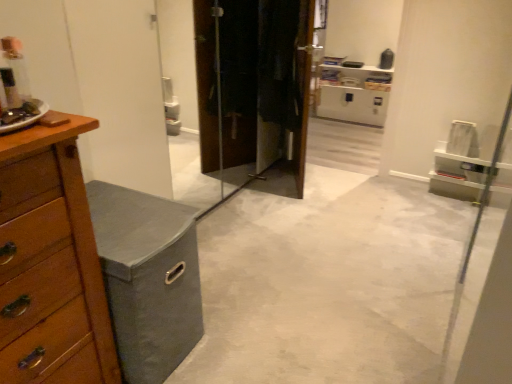
Measure the distance between gray fabric storage bin at left and camera.

gray fabric storage bin at left and camera are 5.24 feet apart from each other.

This screenshot has width=512, height=384. Describe the element at coordinates (148, 278) in the screenshot. I see `wooden vanity at left` at that location.

In order to click on wooden chest of drawers at left in this screenshot , I will do `click(50, 264)`.

Looking at their sizes, would you say gray fabric storage bin at left is wider or thinner than wooden chest of drawers at left?

gray fabric storage bin at left is wider than wooden chest of drawers at left.

In the scene shown: From a real-world perspective, which is physically above, gray fabric storage bin at left or wooden chest of drawers at left?

In real-world perspective, wooden chest of drawers at left is above.

How different are the orientations of gray fabric storage bin at left and wooden chest of drawers at left in degrees?

gray fabric storage bin at left and wooden chest of drawers at left are facing 90.2 degrees away from each other.

Is gray fabric storage bin at left positioned far away from wooden chest of drawers at left?

Indeed, gray fabric storage bin at left is not near wooden chest of drawers at left.

Is wooden chest of drawers at left thinner than wooden vanity at left?

Indeed, wooden chest of drawers at left has a lesser width compared to wooden vanity at left.

Measure the distance between wooden chest of drawers at left and wooden vanity at left.

They are 9.32 inches apart.

Which of these two, wooden chest of drawers at left or wooden vanity at left, is bigger?

Bigger between the two is wooden chest of drawers at left.

Is wooden chest of drawers at left aimed at gray fabric storage bin at left?

No, wooden chest of drawers at left is not oriented towards gray fabric storage bin at left.

From a real-world perspective, between wooden chest of drawers at left and gray fabric storage bin at left, who is vertically higher?

wooden chest of drawers at left, from a real-world perspective.

Considering the points (29, 317) and (345, 180), which point is in front, point (29, 317) or point (345, 180)?

The point (29, 317) is closer to the camera.

Identify the location of the chest of drawers lying in front of the gray fabric storage bin at left. (50, 264).

Is wooden vanity at left aimed at gray fabric storage bin at left?

No.

Is gray fabric storage bin at left completely or partially inside wooden vanity at left?

That's incorrect, gray fabric storage bin at left is not inside wooden vanity at left.

Considering the relative sizes of wooden vanity at left and gray fabric storage bin at left in the image provided, is wooden vanity at left taller than gray fabric storage bin at left?

Indeed, wooden vanity at left has a greater height compared to gray fabric storage bin at left.

Which is less distant, (135, 274) or (444, 306)?

The point (135, 274) is closer to the camera.

From a real-world perspective, between gray fabric storage bin at left and wooden vanity at left, who is vertically higher?

wooden vanity at left, from a real-world perspective.

Which is less distant, [267,313] or [113,319]?

Point [267,313] is positioned farther from the camera compared to point [113,319].

Does gray fabric storage bin at left touch wooden vanity at left?

No, gray fabric storage bin at left is not making contact with wooden vanity at left.

Between gray fabric storage bin at left and wooden vanity at left, which one has more height?

With more height is wooden vanity at left.

Does wooden vanity at left contain wooden chest of drawers at left?

Definitely not — wooden chest of drawers at left is not inside wooden vanity at left.

Is wooden chest of drawers at left at the back of wooden vanity at left?

wooden vanity at left does not have its back to wooden chest of drawers at left.

Is wooden vanity at left next to wooden chest of drawers at left?

wooden vanity at left is not next to wooden chest of drawers at left, and they're not touching.

Is point (105, 285) behind point (85, 292)?

Yes.

The image size is (512, 384). Identify the location of concrete behind the wooden chest of drawers at left. (327, 282).

In order to click on chest of drawers on the left of the wooden vanity at left in this screenshot , I will do `click(50, 264)`.

Estimate the real-world distances between objects in this image. Which object is further from wooden chest of drawers at left, wooden vanity at left or gray fabric storage bin at left?

Based on the image, gray fabric storage bin at left appears to be further to wooden chest of drawers at left.

Looking at the image, which one is located closer to wooden chest of drawers at left, gray fabric storage bin at left or wooden vanity at left?

Based on the image, wooden vanity at left appears to be nearer to wooden chest of drawers at left.

Looking at the image, which one is located closer to gray fabric storage bin at left, wooden chest of drawers at left or wooden vanity at left?

Based on the image, wooden vanity at left appears to be nearer to gray fabric storage bin at left.

Estimate the real-world distances between objects in this image. Which object is closer to wooden vanity at left, gray fabric storage bin at left or wooden chest of drawers at left?

wooden chest of drawers at left is positioned closer to the anchor wooden vanity at left.

Considering their positions, is wooden chest of drawers at left positioned closer to wooden vanity at left than gray fabric storage bin at left?

Among the two, wooden chest of drawers at left is located nearer to wooden vanity at left.

Based on their spatial positions, is wooden vanity at left or wooden chest of drawers at left closer to gray fabric storage bin at left?

The object closer to gray fabric storage bin at left is wooden vanity at left.

Identify the location of vanity between wooden chest of drawers at left and gray fabric storage bin at left from left to right. (148, 278).